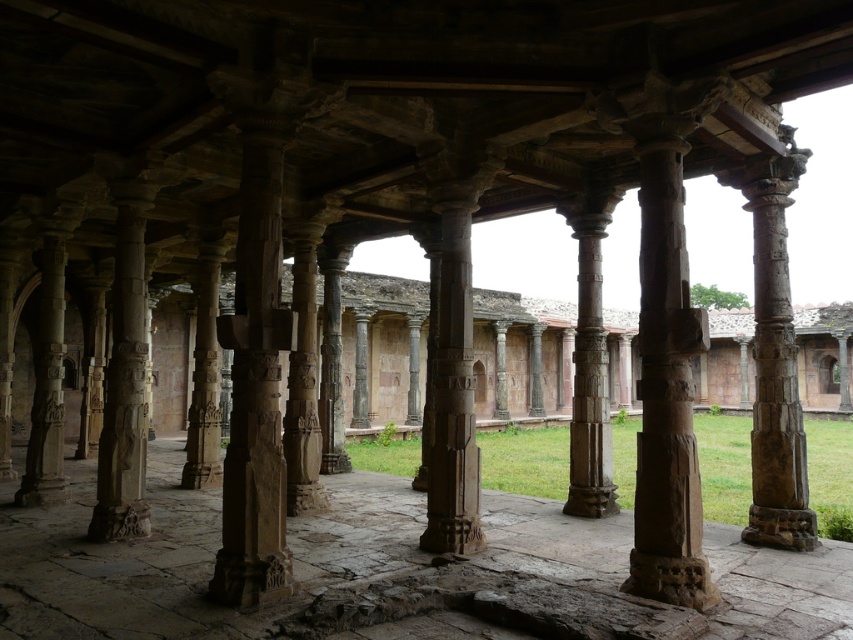
This screenshot has width=853, height=640. What do you see at coordinates (666, 358) in the screenshot?
I see `rustic stone column at center` at bounding box center [666, 358].

From the picture: Is the position of rustic stone column at center less distant than that of carved stone column at left?

Yes.

Does point (648, 518) come behind point (143, 305)?

No, (648, 518) is in front of (143, 305).

Find the location of a particular element. The height and width of the screenshot is (640, 853). rustic stone column at center is located at coordinates click(x=666, y=358).

Does rustic stone column at center have a smaller size compared to brown stone column at center?

No.

Based on the photo, between rustic stone column at center and brown stone column at center, which one appears on the right side from the viewer's perspective?

rustic stone column at center

Identify the location of rustic stone column at center. (666, 358).

Can you confirm if carved stone column at left is wider than carved stone column at center?

Correct, the width of carved stone column at left exceeds that of carved stone column at center.

Which is behind, point (114, 516) or point (587, 412)?

The point (587, 412) is behind.

The width and height of the screenshot is (853, 640). What do you see at coordinates (125, 380) in the screenshot?
I see `carved stone column at left` at bounding box center [125, 380].

At what (x,y) coordinates should I click in order to perform the action: click on carved stone column at left. Please return your answer as a coordinate pair (x, y). Looking at the image, I should click on (125, 380).